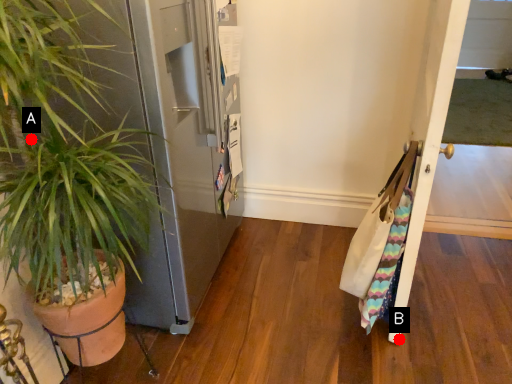
Question: Two points are circled on the image, labeled by A and B beside each circle. Among these points, which one is farthest from the camera?

Choices:
 (A) A is further
 (B) B is further

Answer: (B)